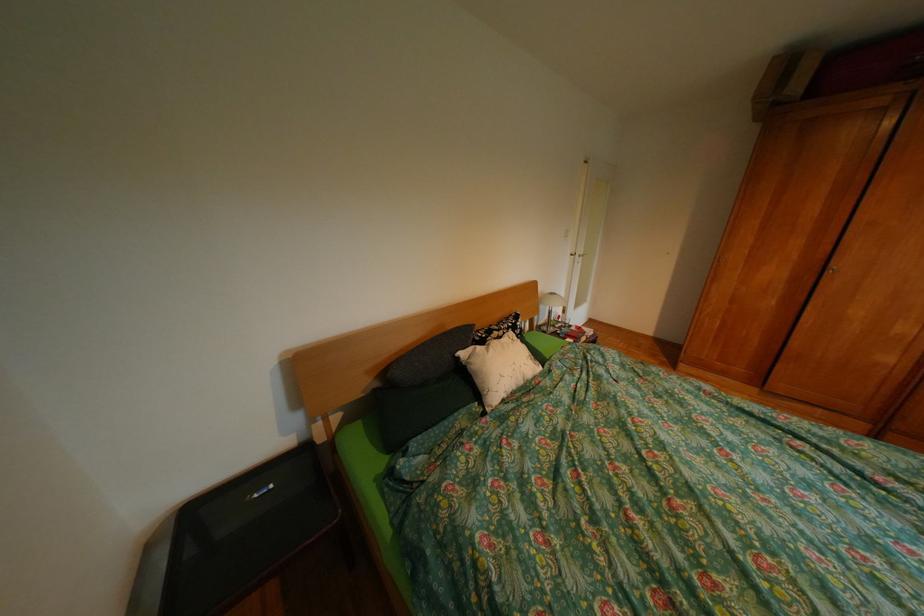
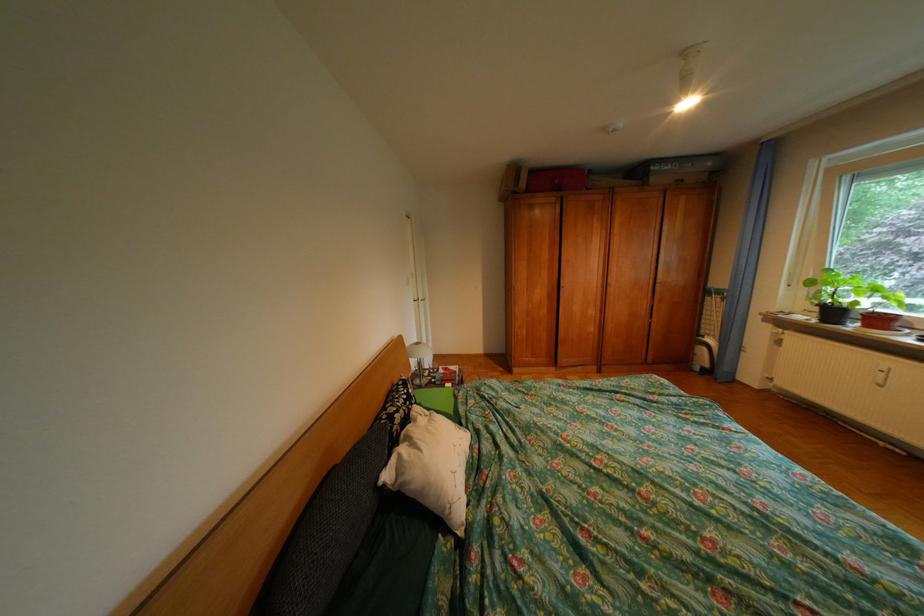
Question: How did the camera likely rotate?

Choices:
 (A) Left
 (B) Right
 (C) Up
 (D) Down

Answer: (B)